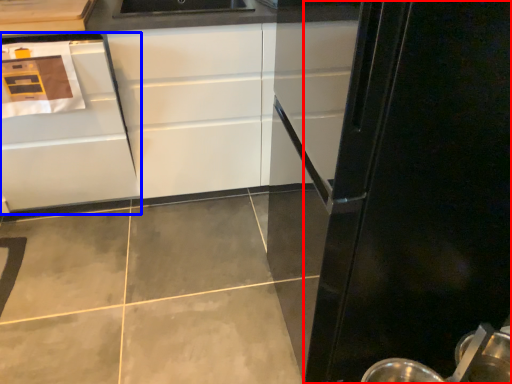
Question: Which point is closer to the camera, glass door (highlighted by a red box) or cabinetry (highlighted by a blue box)?

Choices:
 (A) glass door
 (B) cabinetry

Answer: (A)